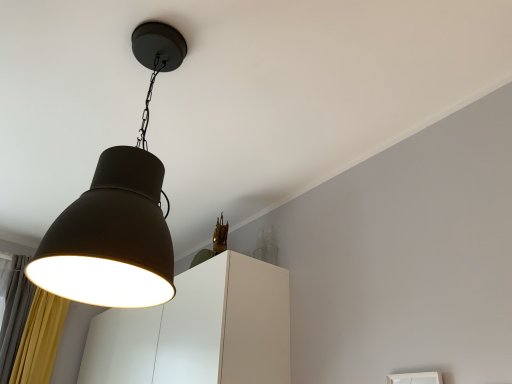
What do you see at coordinates (199, 330) in the screenshot? I see `white matte cabinet at center` at bounding box center [199, 330].

Find the location of a particular element. The width and height of the screenshot is (512, 384). white matte cabinet at center is located at coordinates (199, 330).

Measure the distance between white matte cabinet at center and camera.

5.91 feet.

What do you see at coordinates (117, 213) in the screenshot? I see `matte black lampshade at upper left` at bounding box center [117, 213].

This screenshot has height=384, width=512. I want to click on matte black lampshade at upper left, so click(x=117, y=213).

Image resolution: width=512 pixels, height=384 pixels. Identify the location of white matte cabinet at center. (199, 330).

Based on the photo, is matte black lampshade at upper left at the right side of white matte cabinet at center?

Indeed, matte black lampshade at upper left is positioned on the right side of white matte cabinet at center.

Looking at this image, in the image, is matte black lampshade at upper left positioned in front of or behind white matte cabinet at center?

Clearly, matte black lampshade at upper left is in front of white matte cabinet at center.

Is point (161, 232) positioned before point (175, 306)?

Yes, point (161, 232) is in front of point (175, 306).

From the image's perspective, is matte black lampshade at upper left over white matte cabinet at center?

Correct, matte black lampshade at upper left appears higher than white matte cabinet at center in the image.

From a real-world perspective, is matte black lampshade at upper left positioned above or below white matte cabinet at center?

Clearly, from a real-world perspective, matte black lampshade at upper left is above white matte cabinet at center.

Which object is wider, matte black lampshade at upper left or white matte cabinet at center?

white matte cabinet at center.

Looking at this image, can you confirm if matte black lampshade at upper left is shorter than white matte cabinet at center?

Incorrect, the height of matte black lampshade at upper left does not fall short of that of white matte cabinet at center.

Who is bigger, matte black lampshade at upper left or white matte cabinet at center?

Bigger between the two is white matte cabinet at center.

Can white matte cabinet at center be found inside matte black lampshade at upper left?

That's incorrect, white matte cabinet at center is not inside matte black lampshade at upper left.

Is matte black lampshade at upper left positioned far away from white matte cabinet at center?

They are positioned close to each other.

Could you tell me if matte black lampshade at upper left is facing white matte cabinet at center?

No, matte black lampshade at upper left is not oriented towards white matte cabinet at center.

How different are the orientations of matte black lampshade at upper left and white matte cabinet at center in degrees?

The angular difference between matte black lampshade at upper left and white matte cabinet at center is 0.953 degrees.

In the image, there is a matte black lampshade at upper left. At what (x,y) coordinates should I click in order to perform the action: click on cabinetry below it (from the image's perspective). Please return your answer as a coordinate pair (x, y). Image resolution: width=512 pixels, height=384 pixels. Looking at the image, I should click on (199, 330).

Visually, is white matte cabinet at center positioned to the left or to the right of matte black lampshade at upper left?

white matte cabinet at center is positioned on matte black lampshade at upper left's left side.

Is white matte cabinet at center in front of or behind matte black lampshade at upper left in the image?

white matte cabinet at center is positioned farther from the viewer than matte black lampshade at upper left.

Considering the positions of point (136, 330) and point (150, 296), is point (136, 330) closer or farther from the camera than point (150, 296)?

Point (136, 330) appears to be farther away from the viewer than point (150, 296).

From the image's perspective, would you say white matte cabinet at center is shown under matte black lampshade at upper left?

Yes.

From a real-world perspective, relative to matte black lampshade at upper left, is white matte cabinet at center vertically above or below?

Clearly, from a real-world perspective, white matte cabinet at center is below matte black lampshade at upper left.

Which of these two, white matte cabinet at center or matte black lampshade at upper left, is thinner?

matte black lampshade at upper left.

Considering the relative sizes of white matte cabinet at center and matte black lampshade at upper left in the image provided, is white matte cabinet at center taller than matte black lampshade at upper left?

In fact, white matte cabinet at center may be shorter than matte black lampshade at upper left.

Considering the sizes of objects white matte cabinet at center and matte black lampshade at upper left in the image provided, who is bigger, white matte cabinet at center or matte black lampshade at upper left?

Bigger between the two is white matte cabinet at center.

Is white matte cabinet at center spatially inside matte black lampshade at upper left, or outside of it?

white matte cabinet at center is not inside matte black lampshade at upper left, it's outside.

Would you say white matte cabinet at center is a long distance from matte black lampshade at upper left?

No, white matte cabinet at center is in close proximity to matte black lampshade at upper left.

Could you tell me if white matte cabinet at center is facing matte black lampshade at upper left?

No, white matte cabinet at center does not turn towards matte black lampshade at upper left.

This screenshot has width=512, height=384. I want to click on lamp on the right of the white matte cabinet at center, so click(117, 213).

You are a GUI agent. You are given a task and a screenshot of the screen. Output one action in this format:
    pyautogui.click(x=<x>, y=<y>)
    Task: Click on the lamp located on the right of white matte cabinet at center
    The height and width of the screenshot is (384, 512).
    Given the screenshot: What is the action you would take?
    pyautogui.click(x=117, y=213)

Identify the location of cabinetry located below the matte black lampshade at upper left (from the image's perspective). (199, 330).